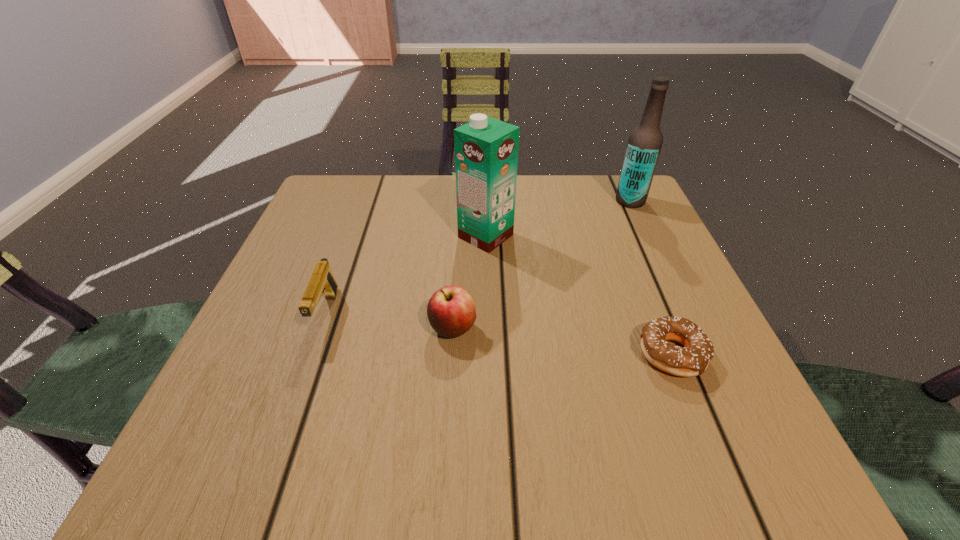
Find the location of a particular element. vacant space at the left edge is located at coordinates (332, 251).

At what (x,y) coordinates should I click in order to perform the action: click on vacant region at the right edge of the desktop. Please return your answer as a coordinate pair (x, y). This screenshot has width=960, height=540. Looking at the image, I should click on (627, 246).

Identify the location of free space at the far left corner of the desktop. This screenshot has height=540, width=960. (318, 225).

Locate an element on the screen. This screenshot has width=960, height=540. vacant region at the far right corner is located at coordinates (610, 178).

Locate an element on the screen. This screenshot has width=960, height=540. free space at the near right corner of the desktop is located at coordinates (742, 446).

I want to click on vacant area that lies between the pistol and the shortest object, so (x=498, y=334).

At what (x,y) coordinates should I click in order to perform the action: click on vacant space that's between the apple and the farthest object. Please return your answer as a coordinate pair (x, y). The image size is (960, 540). Looking at the image, I should click on click(x=541, y=265).

This screenshot has width=960, height=540. Find the location of `free area in between the pistol and the carton`. free area in between the pistol and the carton is located at coordinates (406, 275).

The height and width of the screenshot is (540, 960). In order to click on vacant space that is in between the fourth nearest object and the leftmost object in this screenshot , I will do `click(406, 275)`.

At what (x,y) coordinates should I click in order to perform the action: click on empty space between the beer bottle and the shortest object. Please return your answer as a coordinate pair (x, y). Looking at the image, I should click on (651, 278).